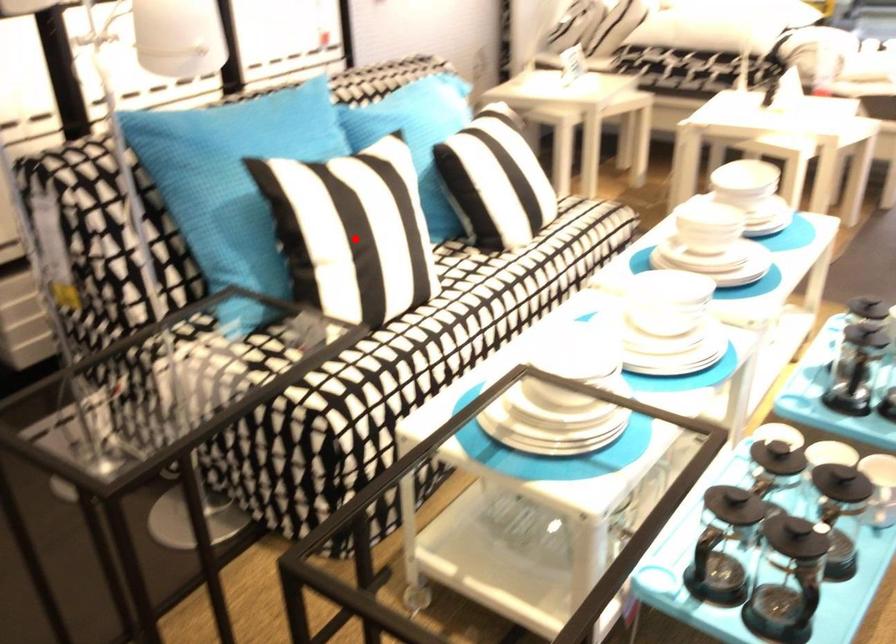
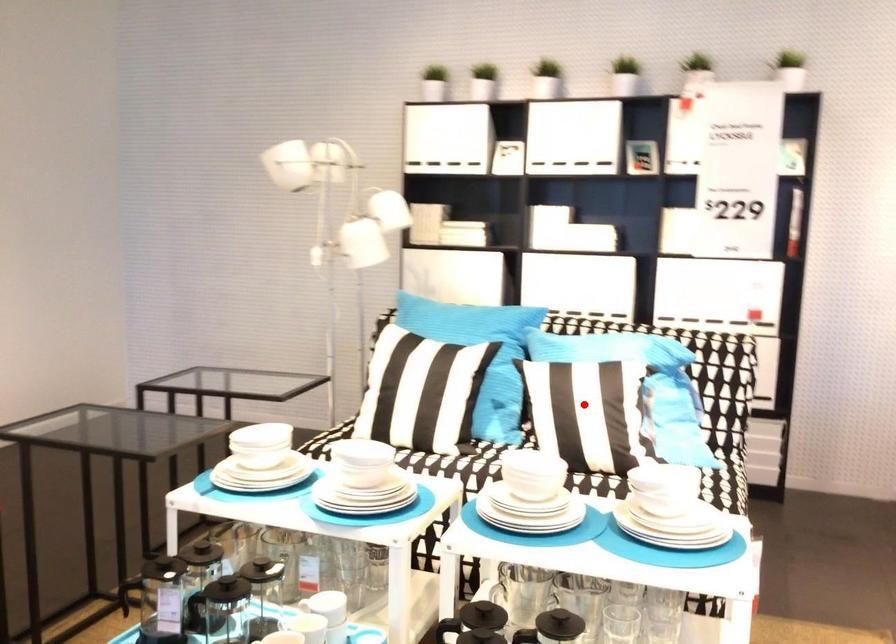
I am providing you with two images of the same scene from different viewpoints. A red point is marked on the first image and another point is marked on the second image. Do the highlighted points in image1 and image2 indicate the same real-world spot?

No